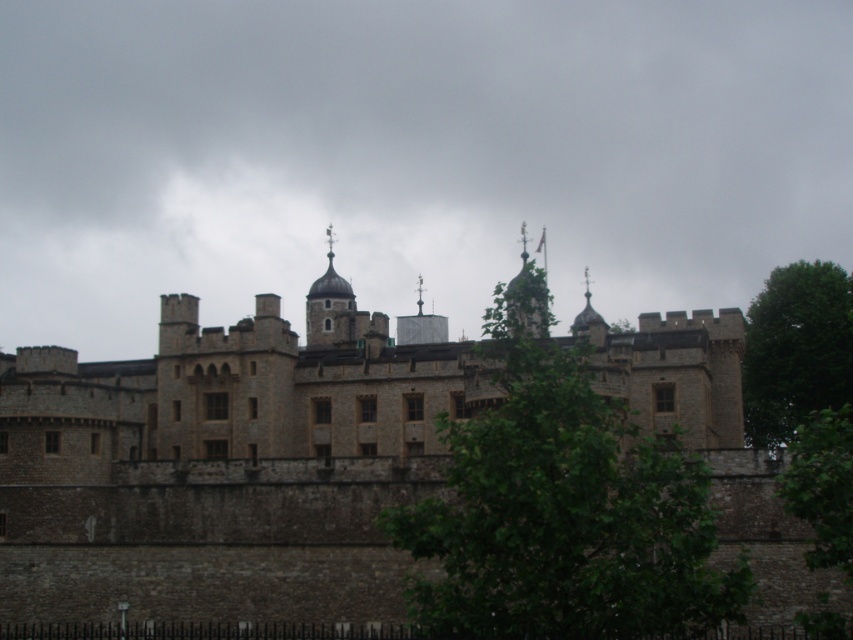
Is point (779, 545) farther from viewer compared to point (793, 288)?

No.

Is stone castle at center thinner than green leafy tree at right?

Incorrect, stone castle at center's width is not less than green leafy tree at right's.

You are a GUI agent. You are given a task and a screenshot of the screen. Output one action in this format:
    pyautogui.click(x=<x>, y=<y>)
    Task: Click on the stone castle at center
    This screenshot has height=640, width=853.
    Given the screenshot: What is the action you would take?
    pyautogui.click(x=223, y=467)

Between point (0, 388) and point (544, 328), which one is positioned behind?

The point (0, 388) is behind.

Who is more forward, (54, 348) or (434, 611)?

Positioned in front is point (434, 611).

Where is `stone castle at center`? The image size is (853, 640). stone castle at center is located at coordinates (223, 467).

Find the location of a particular element. The height and width of the screenshot is (640, 853). stone castle at center is located at coordinates pos(223,467).

Is point (703, 484) more distant than point (788, 330)?

No, it is not.

Can you confirm if green leafy tree at center is positioned above green leafy tree at right?

No.

Locate an element on the screen. green leafy tree at center is located at coordinates (561, 506).